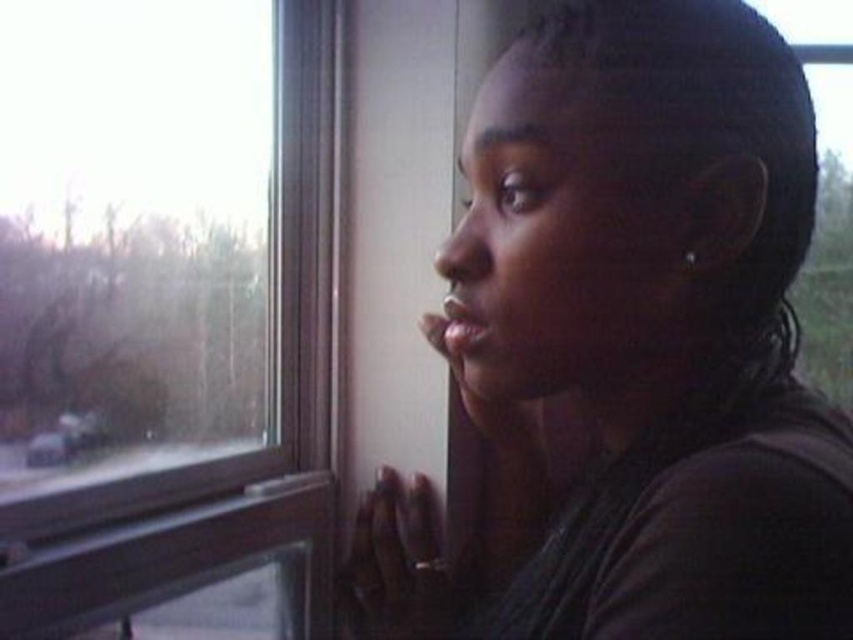
You are an interior designer assessing the space. You need to place a large painting that is 1.2 meters wide between the dark brown hair at upper right and the transparent glass window at upper left. Can the space accommodate the painting?

The dark brown hair at upper right might be wider than transparent glass window at upper left, so the space between them may not be sufficient to fit a painting that is 1.2 meters wide. Further measurements are needed to confirm.

You are an interior designer working on a project and need to place a small decorative item on the windowsill. The windowsill is at point 0.3, 0.8. The dark brown hair at upper right is at point (x=648, y=328). Will placing the item at the windowsill block the view of the dark brown hair at upper right?

The windowsill is at point 0.3, 0.8 and the dark brown hair at upper right is at point (x=648, y=328). Since the windowsill is to the left and slightly above the dark brown hair at upper right, placing the item there would not block the view of the dark brown hair at upper right.

Consider the image. Based on the coordinates provided in the scene, where is the dark brown hair at upper right positioned?

The dark brown hair at upper right is located at point (x=648, y=328).